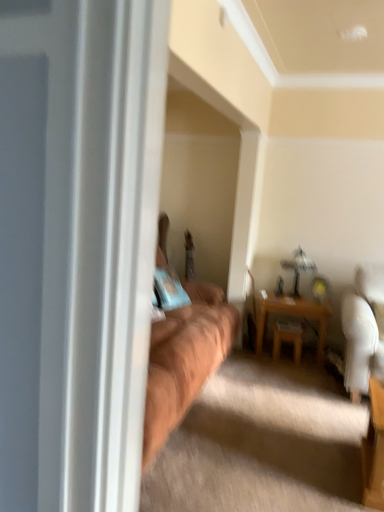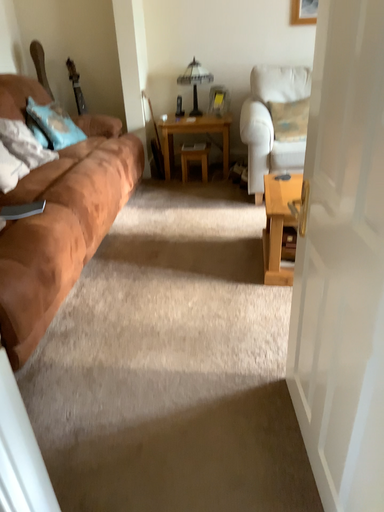
Question: How did the camera likely rotate when shooting the video?

Choices:
 (A) rotated right
 (B) rotated left

Answer: (A)